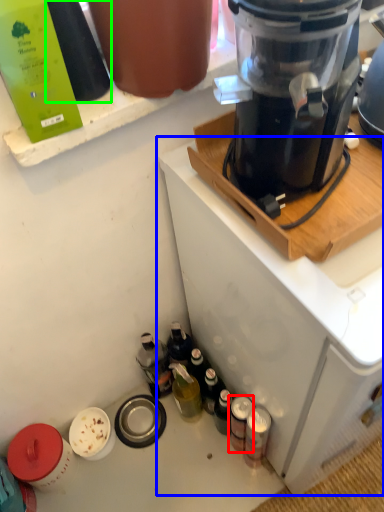
Question: Based on their relative distances, which object is nearer to bottle (highlighted by a red box)? Choose from home appliance (highlighted by a blue box) and bottle (highlighted by a green box).

Choices:
 (A) home appliance
 (B) bottle

Answer: (A)